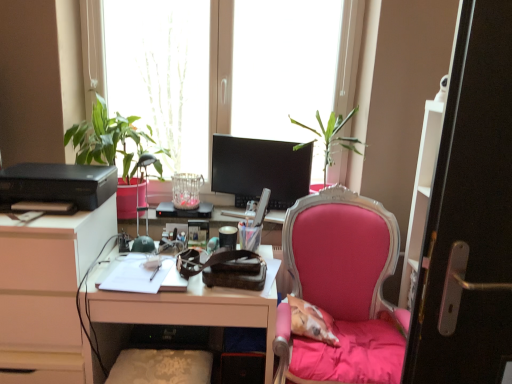
Question: Is black matte printer at left next to pink fabric chair at center?

Choices:
 (A) yes
 (B) no

Answer: (B)

Question: From a real-world perspective, does black matte printer at left sit lower than pink fabric chair at center?

Choices:
 (A) no
 (B) yes

Answer: (A)

Question: Considering the relative positions of black matte printer at left and pink fabric chair at center in the image provided, is black matte printer at left in front of pink fabric chair at center?

Choices:
 (A) yes
 (B) no

Answer: (B)

Question: Does black matte printer at left appear on the right side of pink fabric chair at center?

Choices:
 (A) no
 (B) yes

Answer: (A)

Question: Does black matte printer at left have a greater width compared to pink fabric chair at center?

Choices:
 (A) no
 (B) yes

Answer: (A)

Question: Does black matte printer at left have a lesser width compared to pink fabric chair at center?

Choices:
 (A) no
 (B) yes

Answer: (B)

Question: Can you confirm if matte black monitor at center is bigger than pink fabric chair at center?

Choices:
 (A) no
 (B) yes

Answer: (A)

Question: Is matte black monitor at center smaller than pink fabric chair at center?

Choices:
 (A) no
 (B) yes

Answer: (B)

Question: Is matte black monitor at center further to camera compared to pink fabric chair at center?

Choices:
 (A) yes
 (B) no

Answer: (A)

Question: Considering the relative sizes of matte black monitor at center and pink fabric chair at center in the image provided, is matte black monitor at center thinner than pink fabric chair at center?

Choices:
 (A) yes
 (B) no

Answer: (A)

Question: Is matte black monitor at center facing towards pink fabric chair at center?

Choices:
 (A) no
 (B) yes

Answer: (A)

Question: Does matte black monitor at center have a greater height compared to pink fabric chair at center?

Choices:
 (A) no
 (B) yes

Answer: (A)

Question: Can you confirm if matte black monitor at center is bigger than white glossy desk at center?

Choices:
 (A) no
 (B) yes

Answer: (A)